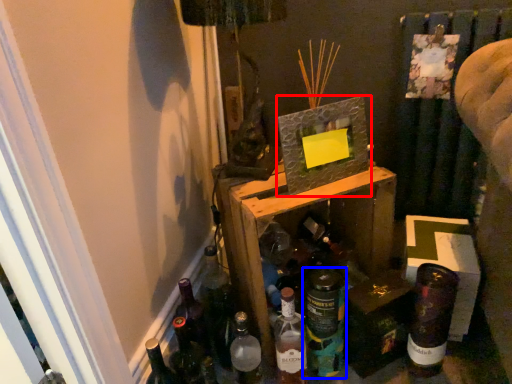
Question: Which of the following is the farthest to the observer, picture frame (highlighted by a red box) or bottle (highlighted by a blue box)?

Choices:
 (A) picture frame
 (B) bottle

Answer: (B)